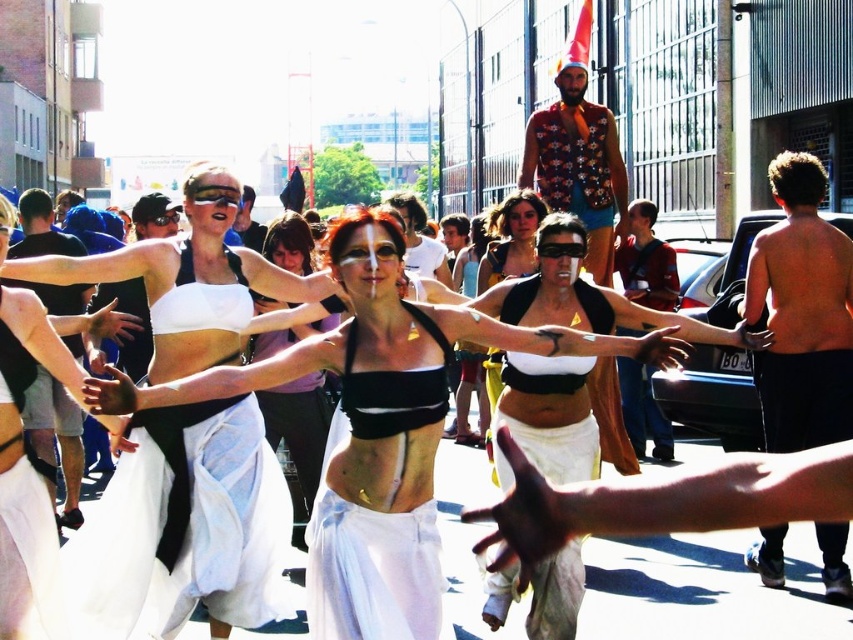
Who is positioned more to the left, shiny blue vest at center or black matte bra at center?

black matte bra at center is more to the left.

Is point (624, 291) positioned before point (480, 289)?

No, (624, 291) is further to viewer.

The width and height of the screenshot is (853, 640). I want to click on shiny blue vest at center, so [x=646, y=260].

Does black fabric shorts at left have a lesser width compared to matte black bra at center?

No, black fabric shorts at left is not thinner than matte black bra at center.

Which is in front, point (9, 282) or point (273, 244)?

Positioned in front is point (273, 244).

Identify the location of black fabric shorts at left. (57, 438).

Does matte black bra at center appear on the right side of matte black tank top at center?

No, matte black bra at center is not to the right of matte black tank top at center.

Which is above, matte black bra at center or matte black tank top at center?

matte black tank top at center is above.

This screenshot has width=853, height=640. Find the location of `matte black bra at center`. matte black bra at center is located at coordinates (299, 428).